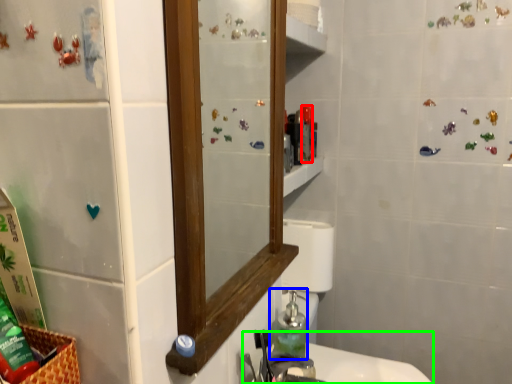
Question: Considering the real-world distances, which object is farthest from toiletry (highlighted by a red box)? soap dispenser (highlighted by a blue box) or sink (highlighted by a green box)?

Choices:
 (A) soap dispenser
 (B) sink

Answer: (B)